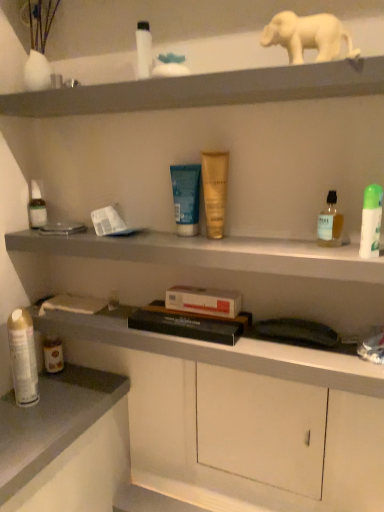
The width and height of the screenshot is (384, 512). In order to click on free point to the left of blue matte tube at center, marked as the fourth toiletry in a front-to-back arrangement in this screenshot , I will do `click(120, 234)`.